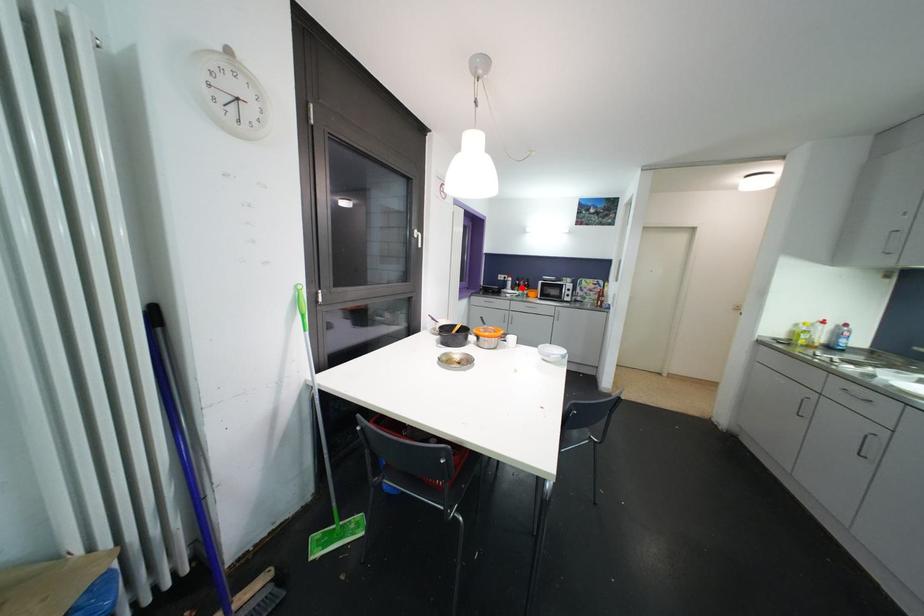
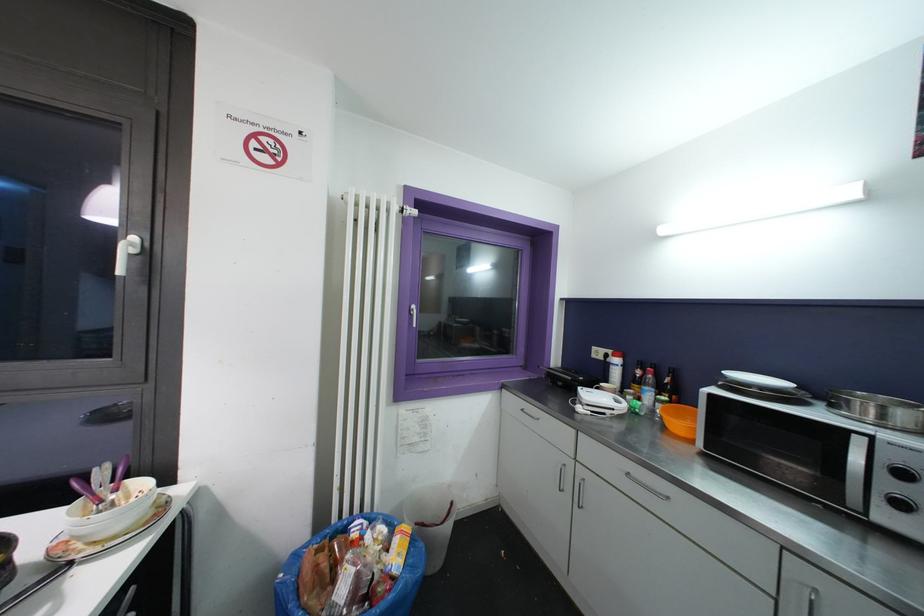
Locate, in the second image, the point that corresponds to the highlighted location in the first image.

(642, 385)